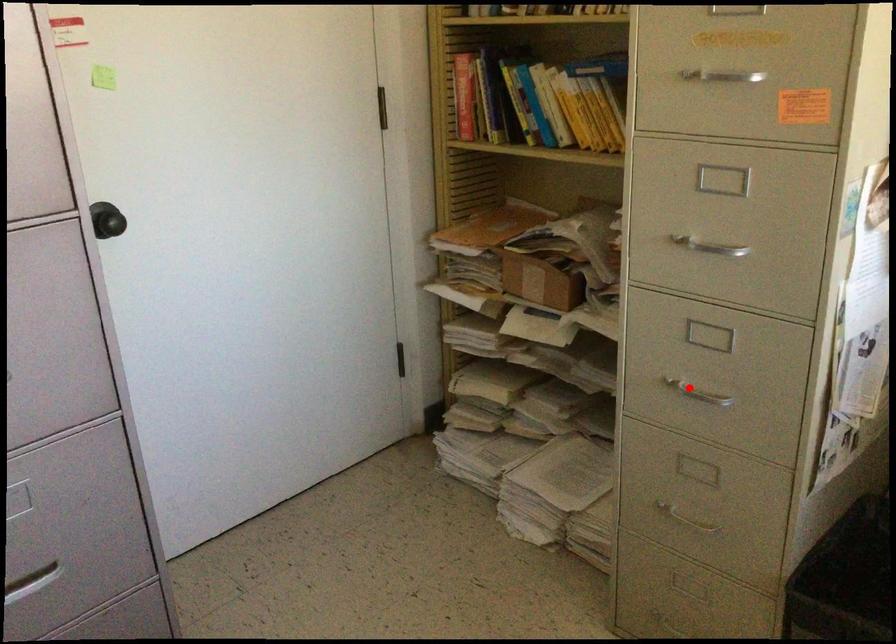
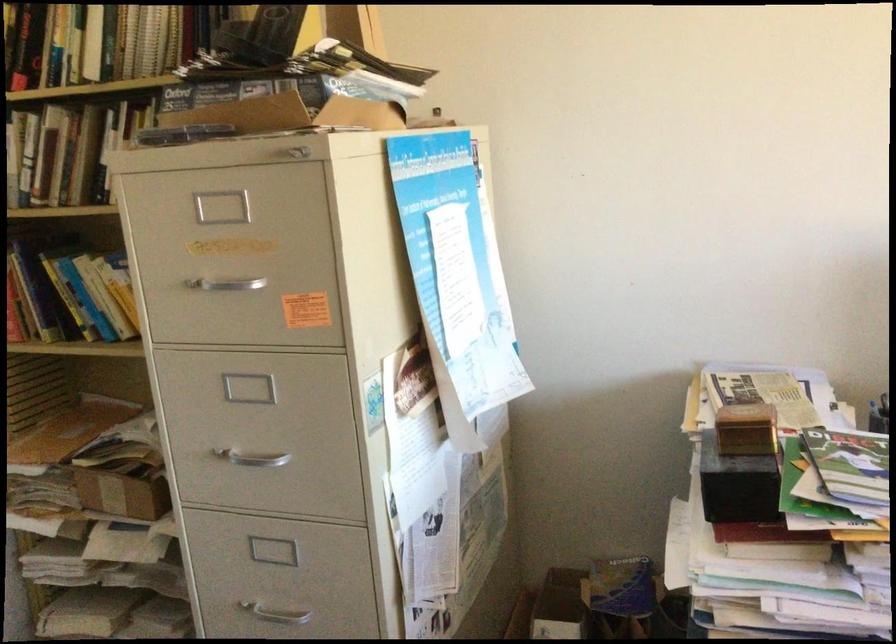
Question: I am providing you with two images of the same scene from different viewpoints. Given a red point in image1, look at the same physical point in image2. Is it:

Choices:
 (A) Closer to the viewpoint
 (B) Farther from the viewpoint

Answer: (A)